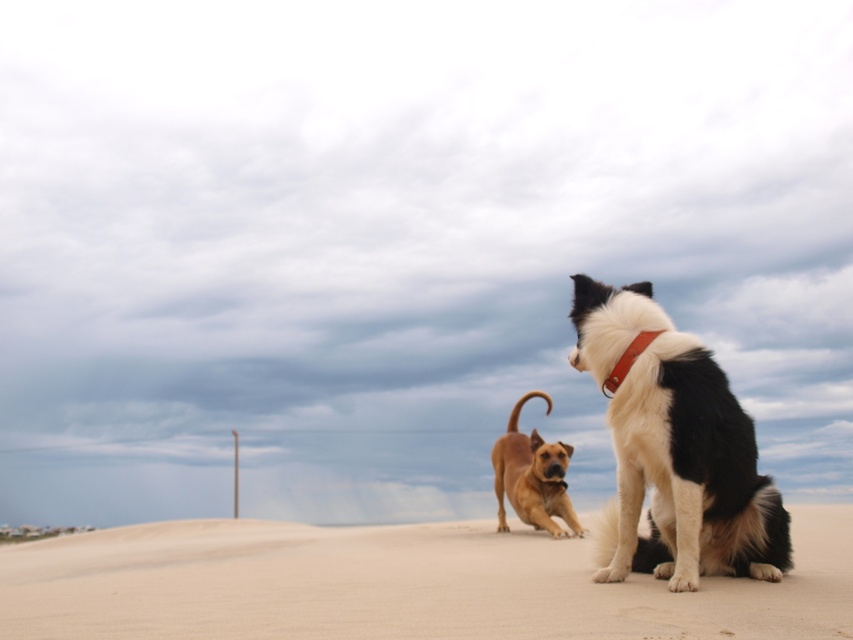
Question: Is sandy beige sand at lower center thinner than brown leather neckband at upper right?

Choices:
 (A) yes
 (B) no

Answer: (B)

Question: Estimate the real-world distances between objects in this image. Which object is farther from the sandy beige sand at lower center?

Choices:
 (A) golden brown fur at center
 (B) brown leather neckband at upper right

Answer: (B)

Question: From the image, what is the correct spatial relationship of sandy beige sand at lower center in relation to golden brown fur at center?

Choices:
 (A) left
 (B) right

Answer: (A)

Question: Does sandy beige sand at lower center have a greater width compared to black and white fur dog at right?

Choices:
 (A) no
 (B) yes

Answer: (B)

Question: Which object appears closest to the camera in this image?

Choices:
 (A) brown leather neckband at upper right
 (B) golden brown fur at center

Answer: (A)

Question: Which object is closer to the camera taking this photo?

Choices:
 (A) golden brown fur at center
 (B) sandy beige sand at lower center

Answer: (B)